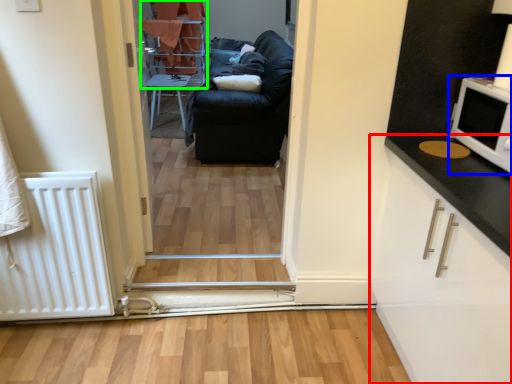
Question: Based on their relative distances, which object is farther from cabinetry (highlighted by a red box)? Choose from appliance (highlighted by a blue box) and bunk bed (highlighted by a green box).

Choices:
 (A) appliance
 (B) bunk bed

Answer: (B)